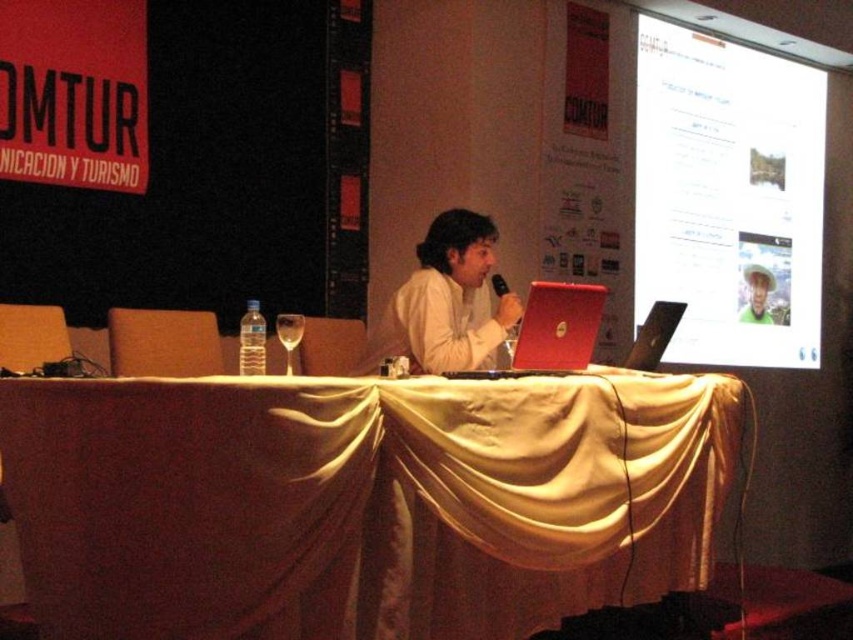
You are organizing a presentation and need to place a decorative centerpiece on the table. The table is at point (361, 500). Where exactly on the table should you place the centerpiece to ensure it is centered?

The white satin table at center is located at point (361, 500), so placing the centerpiece exactly at that coordinate will center it on the table.

Consider the image. You are organizing a conference and need to place a large folder on the table. Given the objects on the table, will the white satin table at center have enough space for the folder if the folder is larger than the red matte laptop at center?

The white satin table at center is bigger than the red matte laptop at center. Since the folder is larger than the laptop, it should fit on the table as long as the table has sufficient space not occupied by other items.